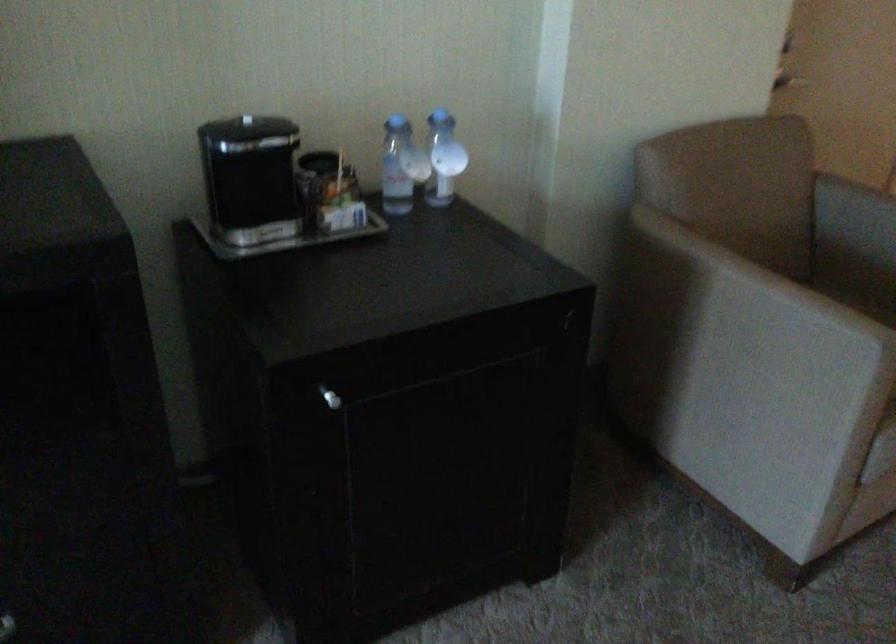
Locate an element on the screen. chair sitting surface is located at coordinates (859, 303).